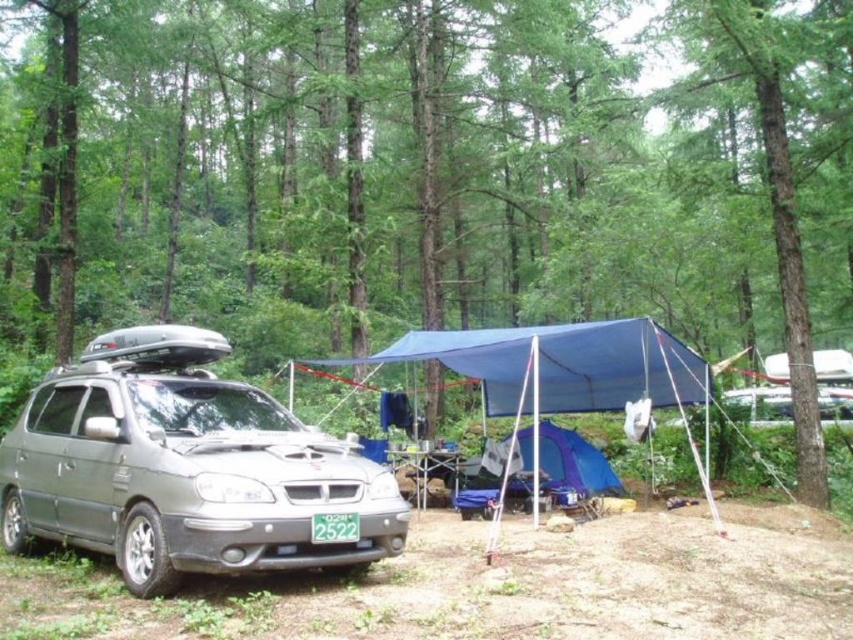
Can you confirm if blue fabric canopy at center is taller than green matte license plate at center?

Indeed, blue fabric canopy at center has a greater height compared to green matte license plate at center.

Does point (492, 378) come closer to viewer compared to point (321, 516)?

That is False.

Where is `blue fabric canopy at center`? The height and width of the screenshot is (640, 853). blue fabric canopy at center is located at coordinates (560, 365).

Looking at this image, which is more to the left, blue fabric tent at center or purple fabric tent at center?

Positioned to the left is purple fabric tent at center.

Find the location of a particular element. The height and width of the screenshot is (640, 853). blue fabric tent at center is located at coordinates (566, 372).

I want to click on blue fabric tent at center, so click(566, 372).

Identify the location of blue fabric tent at center. Image resolution: width=853 pixels, height=640 pixels. (566, 372).

Which of these two, blue fabric tent at center or green matte license plate at center, stands shorter?

With less height is green matte license plate at center.

Is blue fabric tent at center taller than green matte license plate at center?

Yes, blue fabric tent at center is taller than green matte license plate at center.

You are a GUI agent. You are given a task and a screenshot of the screen. Output one action in this format:
    pyautogui.click(x=<x>, y=<y>)
    Task: Click on the blue fabric tent at center
    The height and width of the screenshot is (640, 853).
    Given the screenshot: What is the action you would take?
    pyautogui.click(x=566, y=372)